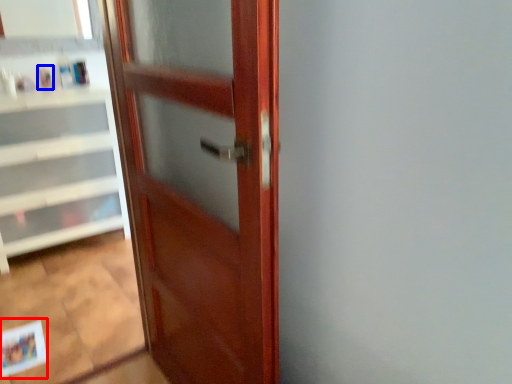
Question: Which object appears closest to the camera in this image, postcard (highlighted by a red box) or toiletry (highlighted by a blue box)?

Choices:
 (A) postcard
 (B) toiletry

Answer: (A)